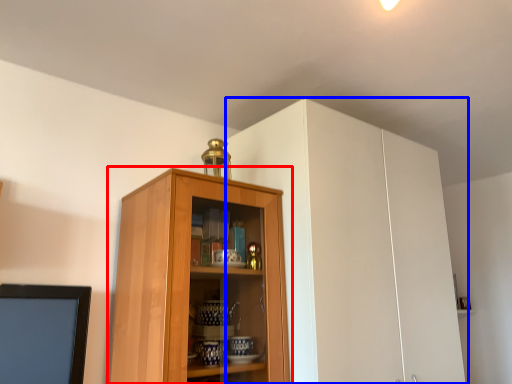
Question: Which object appears farthest to the camera in this image, cupboard (highlighted by a red box) or cabinetry (highlighted by a blue box)?

Choices:
 (A) cupboard
 (B) cabinetry

Answer: (B)